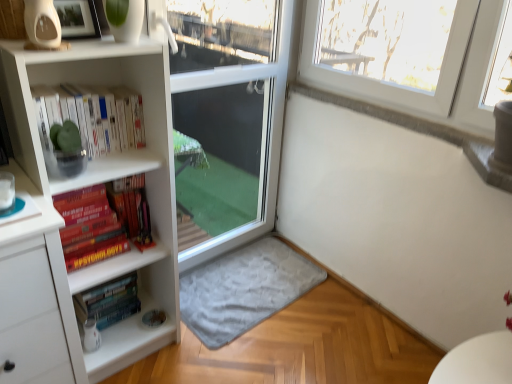
Where is `spots to the right of gray soft rug at lower center`? This screenshot has width=512, height=384. spots to the right of gray soft rug at lower center is located at coordinates (347, 330).